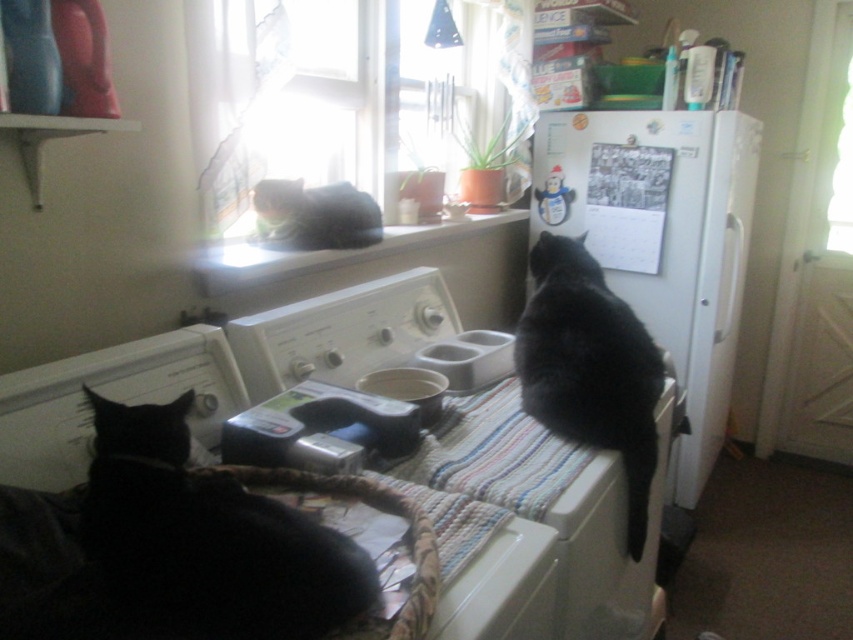
Question: Which object is closer to the camera taking this photo?

Choices:
 (A) white matte refrigerator at right
 (B) black fur cat at upper center
 (C) black fur cat at lower left

Answer: (C)

Question: Is black fur cat at upper right below black fur cat at upper center?

Choices:
 (A) yes
 (B) no

Answer: (A)

Question: Does black fur cat at lower left have a smaller size compared to black fur cat at upper right?

Choices:
 (A) yes
 (B) no

Answer: (A)

Question: Which is farther from the white matte washing machine at upper center?

Choices:
 (A) black fur cat at upper right
 (B) black fur cat at lower left
 (C) black fur cat at upper center
 (D) white matte refrigerator at right

Answer: (D)

Question: Which of the following is the closest to the observer?

Choices:
 (A) (227, 556)
 (B) (699, 180)
 (C) (283, 186)

Answer: (A)

Question: Can you confirm if white matte refrigerator at right is positioned to the left of black fur cat at upper right?

Choices:
 (A) yes
 (B) no

Answer: (B)